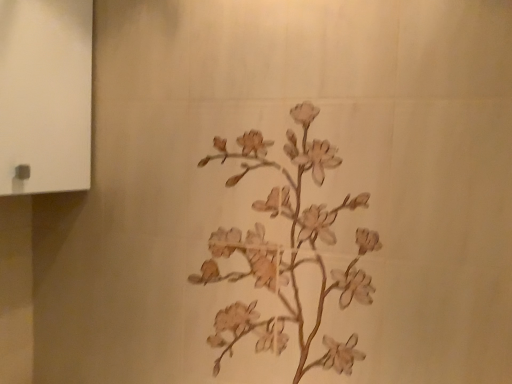
What do you see at coordinates (45, 95) in the screenshot? I see `white matte cabinet at upper left` at bounding box center [45, 95].

The width and height of the screenshot is (512, 384). Identify the location of white matte cabinet at upper left. (45, 95).

Measure the distance between white matte cabinet at upper left and camera.

white matte cabinet at upper left is 88.25 centimeters from camera.

The image size is (512, 384). What are the coordinates of `white matte cabinet at upper left` in the screenshot? It's located at (45, 95).